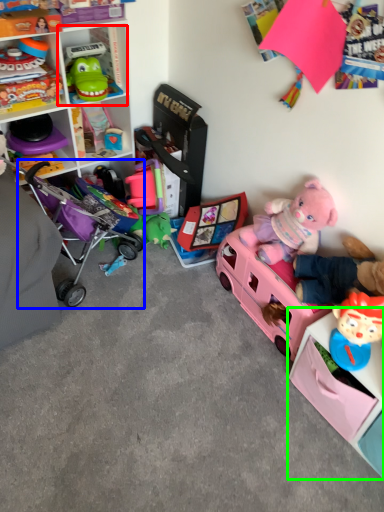
Question: Estimate the real-world distances between objects in this image. Which object is farther from cabinet (highlighted by a red box), baby carriage (highlighted by a blue box) or shelf (highlighted by a green box)?

Choices:
 (A) baby carriage
 (B) shelf

Answer: (B)